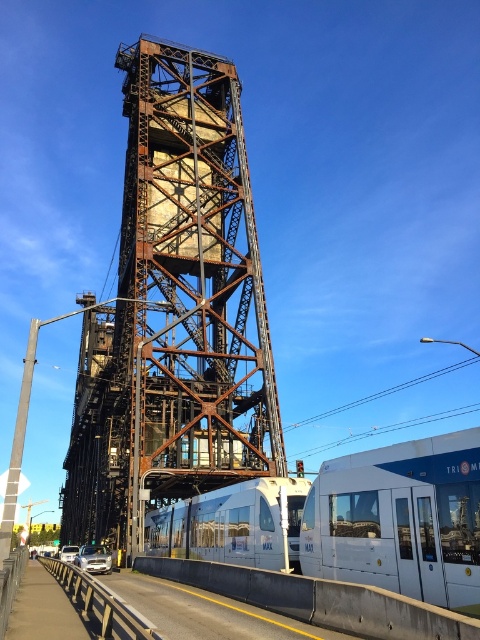
You are a photographer planning to capture the white glossy train at lower right and the white glossy passenger train at lower center in a single shot. Based on their heights, which train should you focus on to ensure both are fully visible in the frame?

The white glossy train at lower right is not as tall as the white glossy passenger train at lower center, so focusing on the taller white glossy passenger train at lower center will ensure both are fully visible in the frame.

You are a photographer standing at the base of the rusted steel bridge. You want to take a photo of the white glossy train at lower right as it approaches the bridge. Considering the train is 29.07 meters away from you, will it be possible to capture the entire train in your camera frame without moving? Explain your reasoning based on the scene description.

The white glossy train at lower right is 29.07 meters away from the camera. Since the photographer is at the base of the bridge and the train is approaching, the distance of 29.07 meters may allow capturing the entire train in the frame if the camera has a wide enough angle. However, without knowing the camera specifications, it is uncertain. The scene description does not provide details about the camera lens or sensor size, so the answer remains conditional on equipment capabilities.

You are a passenger on the white glossy train at lower right approaching the rusty metal tower at center. From your current position, which object will you see first as you move forward?

The rusty metal tower at center will be seen first because the white glossy train at lower right is positioned behind it.